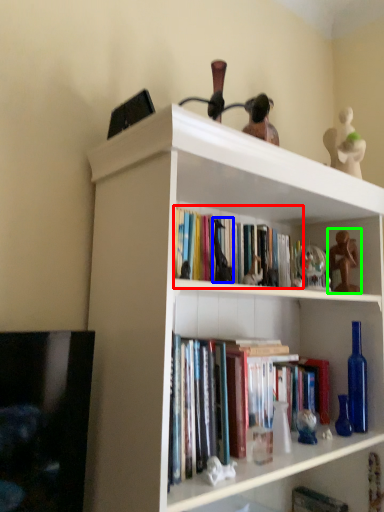
Question: Which object is positioned farthest from book (highlighted by a red box)? Select from toy (highlighted by a blue box) and toy (highlighted by a green box).

Choices:
 (A) toy
 (B) toy

Answer: (B)